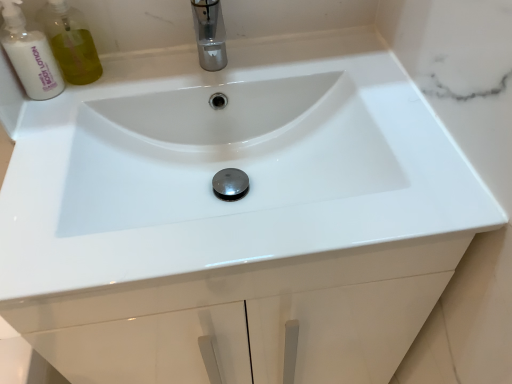
Question: Is white lotion at upper left facing towards polished chrome tap at upper center?

Choices:
 (A) yes
 (B) no

Answer: (B)

Question: Is white lotion at upper left looking in the opposite direction of polished chrome tap at upper center?

Choices:
 (A) no
 (B) yes

Answer: (A)

Question: From a real-world perspective, is white lotion at upper left beneath polished chrome tap at upper center?

Choices:
 (A) no
 (B) yes

Answer: (A)

Question: Is white lotion at upper left wider than polished chrome tap at upper center?

Choices:
 (A) yes
 (B) no

Answer: (B)

Question: Considering the relative sizes of white lotion at upper left and polished chrome tap at upper center in the image provided, is white lotion at upper left thinner than polished chrome tap at upper center?

Choices:
 (A) yes
 (B) no

Answer: (A)

Question: Is white lotion at upper left taller than polished chrome tap at upper center?

Choices:
 (A) no
 (B) yes

Answer: (B)

Question: Can white lotion at upper left be found inside polished chrome tap at upper center?

Choices:
 (A) no
 (B) yes

Answer: (A)

Question: Is polished chrome tap at upper center positioned beyond the bounds of white lotion at upper left?

Choices:
 (A) no
 (B) yes

Answer: (B)

Question: Considering the relative sizes of polished chrome tap at upper center and white lotion at upper left in the image provided, is polished chrome tap at upper center smaller than white lotion at upper left?

Choices:
 (A) yes
 (B) no

Answer: (B)

Question: Is the position of polished chrome tap at upper center more distant than that of white lotion at upper left?

Choices:
 (A) no
 (B) yes

Answer: (A)

Question: From the image's perspective, does polished chrome tap at upper center appear higher than white lotion at upper left?

Choices:
 (A) yes
 (B) no

Answer: (A)

Question: Is polished chrome tap at upper center not close to white lotion at upper left?

Choices:
 (A) no
 (B) yes

Answer: (A)

Question: Is polished chrome tap at upper center bigger or smaller than white lotion at upper left?

Choices:
 (A) big
 (B) small

Answer: (A)